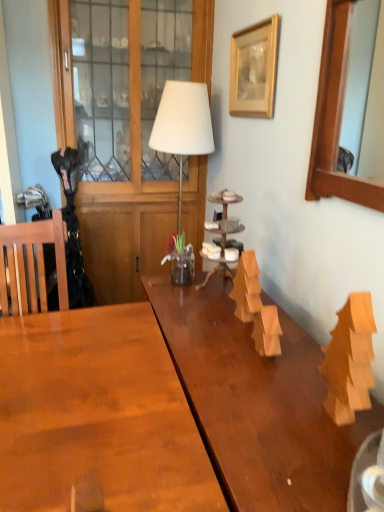
Question: Is white matte table lamp at center shorter than wooden mirror at upper right, the 1th picture frame when ordered from right to left?

Choices:
 (A) no
 (B) yes

Answer: (A)

Question: Considering the relative sizes of white matte table lamp at center and wooden mirror at upper right, the 1th picture frame when ordered from right to left, in the image provided, is white matte table lamp at center thinner than wooden mirror at upper right, the 1th picture frame when ordered from right to left,?

Choices:
 (A) no
 (B) yes

Answer: (A)

Question: Is white matte table lamp at center directly adjacent to wooden mirror at upper right, the 2th picture frame when ordered from left to right?

Choices:
 (A) yes
 (B) no

Answer: (B)

Question: From a real-world perspective, is white matte table lamp at center located higher than wooden mirror at upper right, the 2th picture frame when ordered from left to right?

Choices:
 (A) yes
 (B) no

Answer: (B)

Question: Does white matte table lamp at center have a larger size compared to wooden mirror at upper right, which is counted as the 2th picture frame, starting from the back?

Choices:
 (A) no
 (B) yes

Answer: (B)

Question: Considering the positions of wooden cabinet at left and wooden mirror at upper right, arranged as the 1th picture frame when viewed from the front, in the image, is wooden cabinet at left taller or shorter than wooden mirror at upper right, arranged as the 1th picture frame when viewed from the front,?

Choices:
 (A) short
 (B) tall

Answer: (B)

Question: Visually, is wooden cabinet at left positioned to the left or to the right of wooden mirror at upper right, the 2th picture frame when ordered from left to right?

Choices:
 (A) right
 (B) left

Answer: (B)

Question: Looking at their shapes, would you say wooden cabinet at left is wider or thinner than wooden mirror at upper right, the 2th picture frame when ordered from left to right?

Choices:
 (A) thin
 (B) wide

Answer: (B)

Question: Is wooden cabinet at left in front of or behind wooden mirror at upper right, the 1th picture frame when ordered from right to left, in the image?

Choices:
 (A) front
 (B) behind

Answer: (B)

Question: Relative to white matte table lamp at center, is wooden picture frame at upper center, which is the first picture frame in left-to-right order, in front or behind?

Choices:
 (A) front
 (B) behind

Answer: (A)

Question: Looking at the image, does wooden picture frame at upper center, which is the first picture frame in left-to-right order, seem bigger or smaller compared to white matte table lamp at center?

Choices:
 (A) small
 (B) big

Answer: (A)

Question: Choose the correct answer: Is wooden picture frame at upper center, which appears as the 2th picture frame when viewed from the right, inside white matte table lamp at center or outside it?

Choices:
 (A) inside
 (B) outside

Answer: (B)

Question: Considering the relative positions of wooden picture frame at upper center, the second picture frame in the front-to-back sequence, and white matte table lamp at center in the image provided, is wooden picture frame at upper center, the second picture frame in the front-to-back sequence, to the left or to the right of white matte table lamp at center?

Choices:
 (A) right
 (B) left

Answer: (A)

Question: From a real-world perspective, is wooden picture frame at upper center, which is the first picture frame in left-to-right order, positioned above or below wooden mirror at upper right, which is counted as the 2th picture frame, starting from the back?

Choices:
 (A) above
 (B) below

Answer: (A)

Question: Relative to wooden mirror at upper right, arranged as the 1th picture frame when viewed from the front, is wooden picture frame at upper center, the second picture frame in the front-to-back sequence, in front or behind?

Choices:
 (A) behind
 (B) front

Answer: (A)